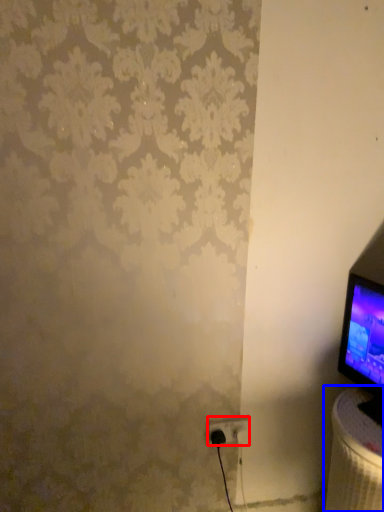
Question: Which point is closer to the camera, power plugs and sockets (highlighted by a red box) or table (highlighted by a blue box)?

Choices:
 (A) power plugs and sockets
 (B) table

Answer: (B)